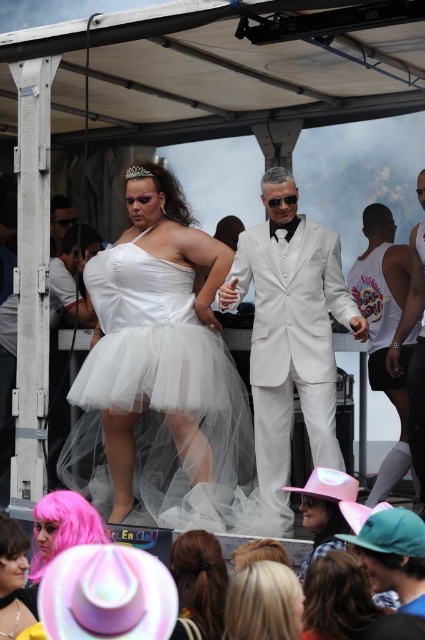
Based on the provided scene description, where is the white tulle wig at center located in terms of its 2D coordinates?

The white tulle wig at center is located at the 2D coordinates point (164, 189).

You are a photographer at the event and want to capture both the pink felt cowboy hat at lower center and the black matte wig at center in a single photo. Based on their positions, can you tell me which object is closer to the camera?

The pink felt cowboy hat at lower center is below the black matte wig at center, so the black matte wig at center is closer to the camera since it is positioned above the pink felt cowboy hat at lower center.

You are at the lively outdoor event under the white canopy and want to take a photo of both point (320, 470) and point (265, 172). Since you want both points to be visible in the photo, will you need to adjust your camera angle to avoid one blocking the other?

Point (320, 470) is in front of point (265, 172), so you will need to adjust your camera angle to ensure both points are visible without one blocking the other.